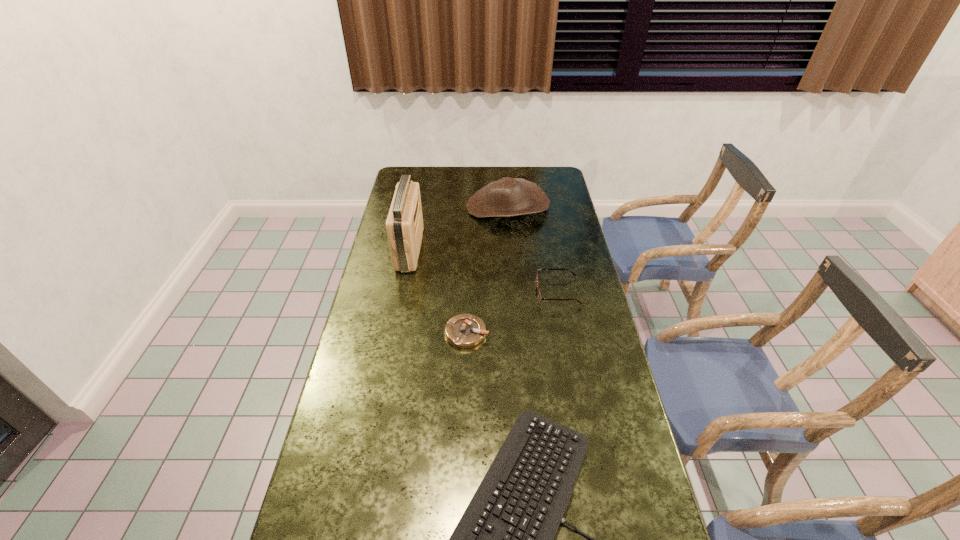
This screenshot has height=540, width=960. What are the coordinates of `free region located 0.280m on the lenses of the third shortest object` in the screenshot? It's located at coord(457,292).

I want to click on free space located on the lenses of the third shortest object, so click(451, 292).

This screenshot has width=960, height=540. In order to click on free spot located 0.260m on the front of the second nearest object in this screenshot , I will do `click(465, 426)`.

The width and height of the screenshot is (960, 540). I want to click on object that is at the far edge, so click(507, 197).

Image resolution: width=960 pixels, height=540 pixels. In order to click on object that is positioned at the left edge in this screenshot , I will do `click(404, 224)`.

The height and width of the screenshot is (540, 960). Identify the location of cowboy hat situated at the right edge. (507, 197).

Where is `spectacles at the right edge`? This screenshot has height=540, width=960. spectacles at the right edge is located at coordinates (539, 296).

The height and width of the screenshot is (540, 960). I want to click on object present at the far right corner, so click(x=507, y=197).

In the image, there is a desktop. Where is `blank space at the far edge`? blank space at the far edge is located at coordinates [490, 181].

In the image, there is a desktop. Find the location of `free space at the left edge`. free space at the left edge is located at coordinates (389, 303).